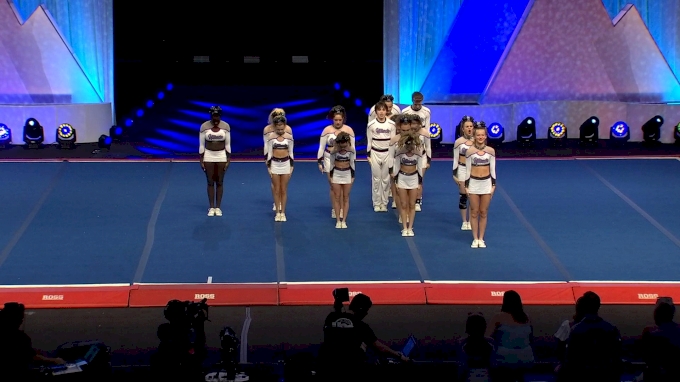
Locate an element on the screen. stage is located at coordinates (165, 227).